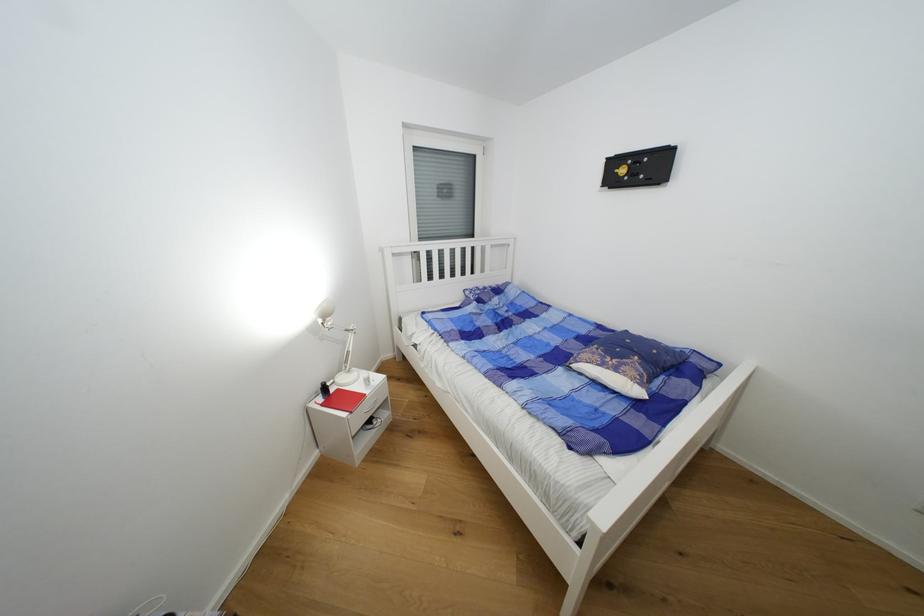
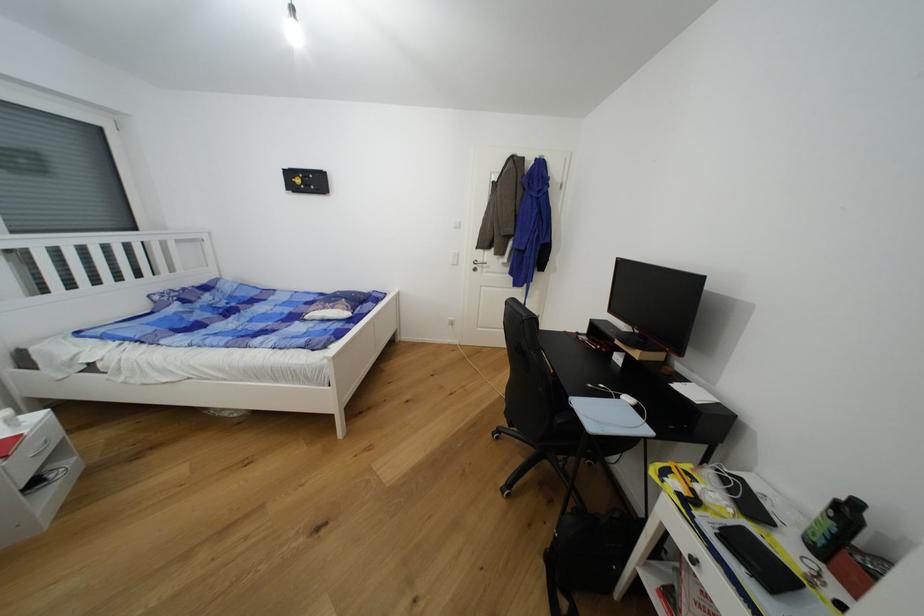
The point at (622,371) is marked in the first image. Where is the corresponding point in the second image?

(337, 310)